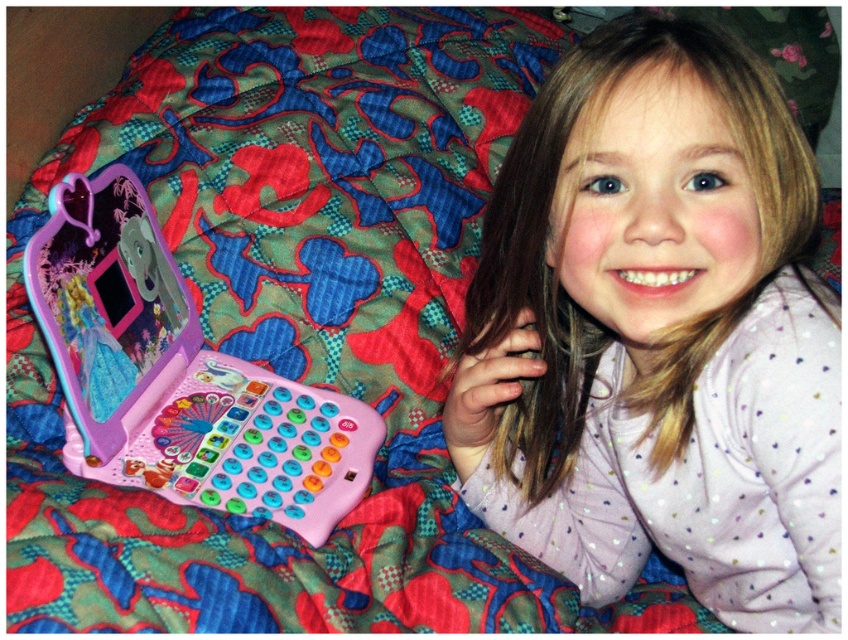
Question: Can you confirm if pink fabric at upper right is positioned to the right of pink plastic toy laptop at left?

Choices:
 (A) no
 (B) yes

Answer: (B)

Question: Which object appears closest to the camera in this image?

Choices:
 (A) pink plastic toy laptop at left
 (B) pink fabric at upper right

Answer: (B)

Question: Which point is farther to the camera?

Choices:
 (A) (127, 289)
 (B) (713, 138)

Answer: (A)

Question: Can you confirm if pink fabric at upper right is thinner than pink plastic toy laptop at left?

Choices:
 (A) no
 (B) yes

Answer: (B)

Question: Can you confirm if pink fabric at upper right is positioned to the left of pink plastic toy laptop at left?

Choices:
 (A) no
 (B) yes

Answer: (A)